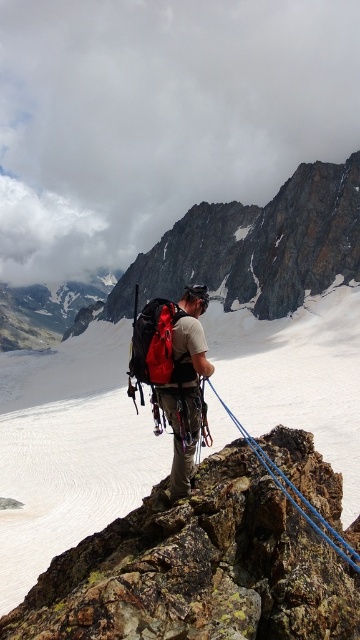
Question: Among these objects, which one is nearest to the camera?

Choices:
 (A) blue nylon rope at center
 (B) rusty rock at center

Answer: (B)

Question: Which point appears closest to the camera in this image?

Choices:
 (A) (272, 468)
 (B) (57, 586)

Answer: (B)

Question: Is rusty rock at center thinner than blue nylon rope at center?

Choices:
 (A) yes
 (B) no

Answer: (B)

Question: Does rusty rock at center appear on the left side of blue nylon rope at center?

Choices:
 (A) no
 (B) yes

Answer: (B)

Question: Which object appears farthest from the camera in this image?

Choices:
 (A) rusty rock at center
 (B) blue nylon rope at center

Answer: (B)

Question: Can you confirm if rusty rock at center is wider than blue nylon rope at center?

Choices:
 (A) no
 (B) yes

Answer: (B)